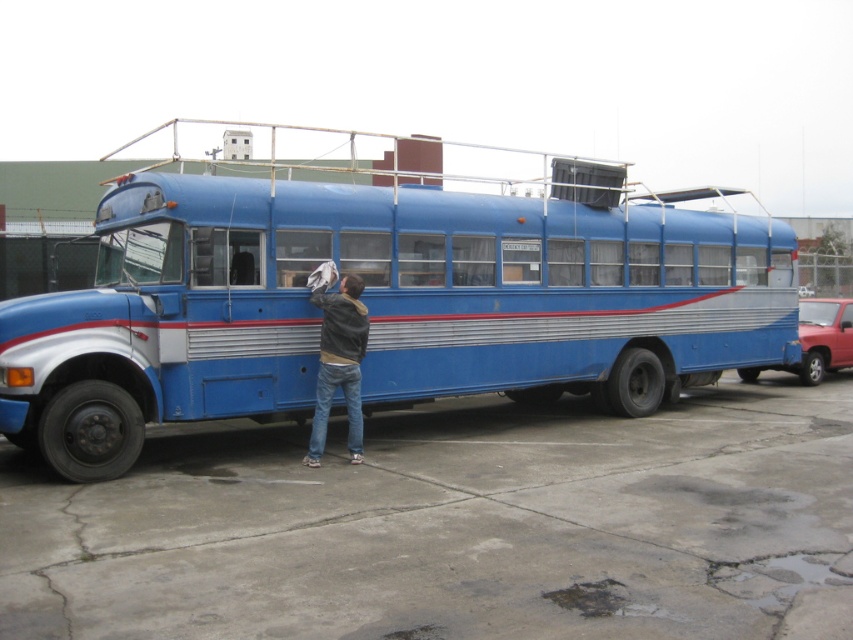
Question: Can you confirm if concrete at lower center is positioned below jeans at lower center?

Choices:
 (A) no
 (B) yes

Answer: (B)

Question: Can you confirm if concrete at lower center is bigger than blue metallic bus at center?

Choices:
 (A) yes
 (B) no

Answer: (B)

Question: Based on their relative distances, which object is farther from the concrete at lower center?

Choices:
 (A) jeans at lower center
 (B) blue metallic bus at center

Answer: (B)

Question: Does blue metallic bus at center come behind jeans at lower center?

Choices:
 (A) yes
 (B) no

Answer: (B)

Question: Which point is farther to the camera?

Choices:
 (A) concrete at lower center
 (B) blue metallic bus at center
 (C) jeans at lower center

Answer: (C)

Question: Estimate the real-world distances between objects in this image. Which object is closer to the jeans at lower center?

Choices:
 (A) concrete at lower center
 (B) blue metallic bus at center

Answer: (A)